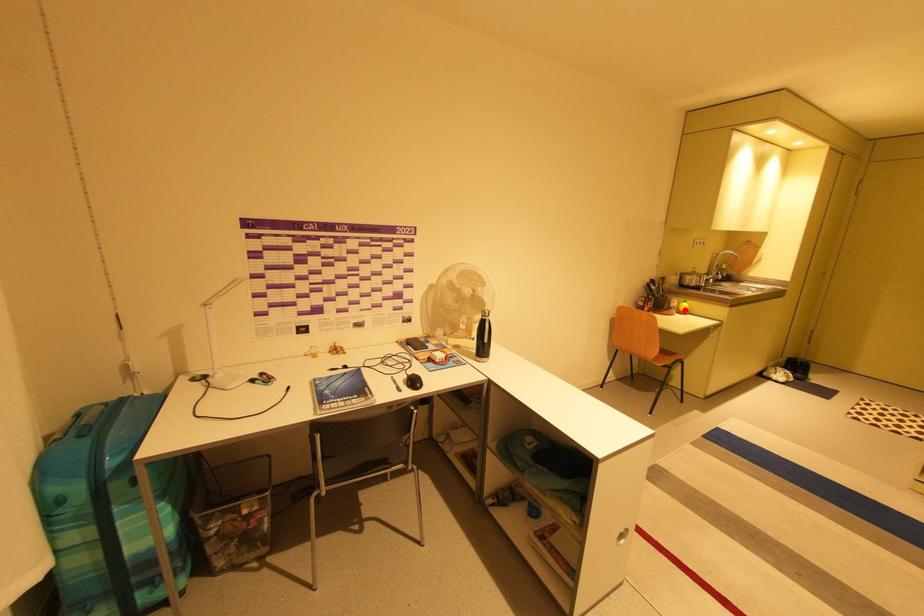
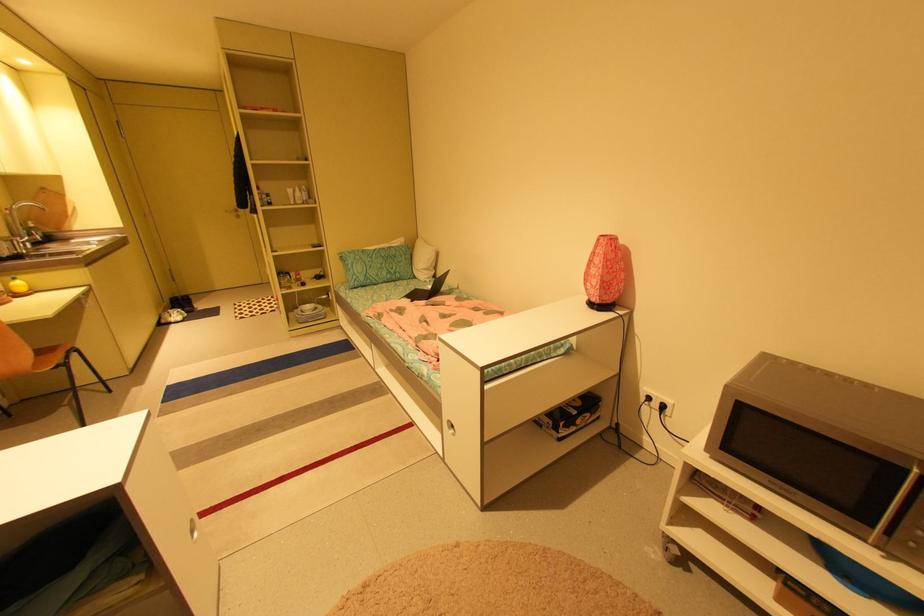
Question: A red point is marked in image1. In image2, is the corresponding 3D point closer to the camera or farther? Reply with the corresponding letter.

Choices:
 (A) The corresponding 3D point is closer.
 (B) The corresponding 3D point is farther.

Answer: (B)